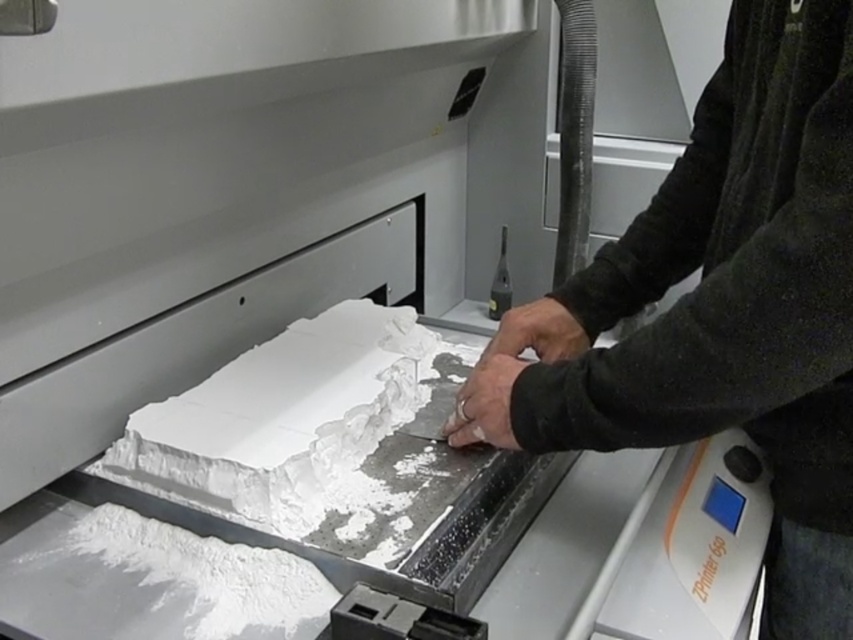
You are a chef observing a dessert display. You notice the black matte hands at center and the white matte cake at center. Which object is closer to you in the scene?

The black matte hands at center are closer to you since they are positioned in front of the white matte cake at center.

You are an assistant helping someone bake a cake. You see the black matte hands at center and the white matte cake at center. Which object is positioned higher in the image?

The black matte hands at center are above the white matte cake at center, so they are positioned higher in the image.